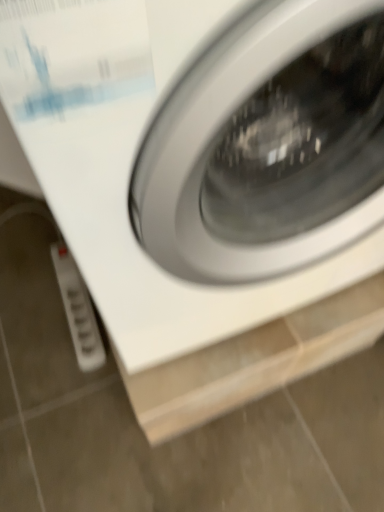
This screenshot has height=512, width=384. Describe the element at coordinates (78, 310) in the screenshot. I see `white plastic power strip at lower left` at that location.

The height and width of the screenshot is (512, 384). What are the coordinates of `white plastic power strip at lower left` in the screenshot? It's located at (78, 310).

What is the approximate width of white glossy washing machine at center?

It is 23.21 inches.

Looking at this image, measure the distance between point (215,240) and camera.

Point (215,240) and camera are 20.00 inches apart.

Describe the element at coordinates (203, 155) in the screenshot. I see `white glossy washing machine at center` at that location.

At what (x,y) coordinates should I click in order to perform the action: click on white glossy washing machine at center. Please return your answer as a coordinate pair (x, y). Looking at the image, I should click on (203, 155).

Find the location of a particular element. This screenshot has width=384, height=512. white plastic power strip at lower left is located at coordinates (78, 310).

Which is more to the right, white glossy washing machine at center or white plastic power strip at lower left?

Positioned to the right is white glossy washing machine at center.

Relative to white plastic power strip at lower left, is white glossy washing machine at center in front or behind?

white glossy washing machine at center is in front of white plastic power strip at lower left.

Which is less distant, (165, 290) or (88, 365)?

Clearly, point (165, 290) is closer to the camera than point (88, 365).

From the image's perspective, is white glossy washing machine at center located beneath white plastic power strip at lower left?

Actually, white glossy washing machine at center appears above white plastic power strip at lower left in the image.

From a real-world perspective, between white glossy washing machine at center and white plastic power strip at lower left, who is vertically higher?

white glossy washing machine at center, from a real-world perspective.

Is white glossy washing machine at center thinner than white plastic power strip at lower left?

Incorrect, the width of white glossy washing machine at center is not less than that of white plastic power strip at lower left.

In terms of height, does white glossy washing machine at center look taller or shorter compared to white plastic power strip at lower left?

Clearly, white glossy washing machine at center is taller compared to white plastic power strip at lower left.

Is white glossy washing machine at center smaller than white plastic power strip at lower left?

No, white glossy washing machine at center is not smaller than white plastic power strip at lower left.

Can white plastic power strip at lower left be found inside white glossy washing machine at center?

No, white plastic power strip at lower left is not inside white glossy washing machine at center.

Is white glossy washing machine at center beside white plastic power strip at lower left?

white glossy washing machine at center and white plastic power strip at lower left are not in contact.

Does white glossy washing machine at center turn towards white plastic power strip at lower left?

No.

Could you measure the distance between white glossy washing machine at center and white plastic power strip at lower left?

A distance of 24.45 inches exists between white glossy washing machine at center and white plastic power strip at lower left.

Image resolution: width=384 pixels, height=512 pixels. Find the location of `washing machine that is in front of the white plastic power strip at lower left`. washing machine that is in front of the white plastic power strip at lower left is located at coordinates (203, 155).

Considering the positions of objects white plastic power strip at lower left and white glossy washing machine at center in the image provided, who is more to the left, white plastic power strip at lower left or white glossy washing machine at center?

white plastic power strip at lower left is more to the left.

Looking at this image, does white plastic power strip at lower left lie in front of white glossy washing machine at center?

No.

Is point (81, 292) positioned before point (238, 234)?

No, it is not.

From the image's perspective, between white plastic power strip at lower left and white glossy washing machine at center, which one is located above?

From the image's view, white glossy washing machine at center is above.

From a real-world perspective, is white plastic power strip at lower left positioned under white glossy washing machine at center based on gravity?

Yes, from a real-world perspective, white plastic power strip at lower left is below white glossy washing machine at center.

Considering the sizes of objects white plastic power strip at lower left and white glossy washing machine at center in the image provided, who is thinner, white plastic power strip at lower left or white glossy washing machine at center?

With smaller width is white plastic power strip at lower left.

Who is shorter, white plastic power strip at lower left or white glossy washing machine at center?

Standing shorter between the two is white plastic power strip at lower left.

Considering the sizes of objects white plastic power strip at lower left and white glossy washing machine at center in the image provided, who is bigger, white plastic power strip at lower left or white glossy washing machine at center?

white glossy washing machine at center is bigger.

Consider the image. Can we say white plastic power strip at lower left lies outside white glossy washing machine at center?

white plastic power strip at lower left lies outside white glossy washing machine at center's area.

Is white plastic power strip at lower left not close to white glossy washing machine at center?

Actually, white plastic power strip at lower left and white glossy washing machine at center are a little close together.

Looking at this image, is white plastic power strip at lower left facing away from white glossy washing machine at center?

No, white plastic power strip at lower left's orientation is not away from white glossy washing machine at center.

Can you tell me how much white plastic power strip at lower left and white glossy washing machine at center differ in facing direction?

1.71 degrees.

Where is `washing machine above the white plastic power strip at lower left (from a real-world perspective)`? Image resolution: width=384 pixels, height=512 pixels. washing machine above the white plastic power strip at lower left (from a real-world perspective) is located at coordinates (203, 155).

Locate an element on the screen. Image resolution: width=384 pixels, height=512 pixels. washing machine to the right of white plastic power strip at lower left is located at coordinates (203, 155).

In the image, there is a white plastic power strip at lower left. Identify the location of washing machine above it (from the image's perspective). (x=203, y=155).